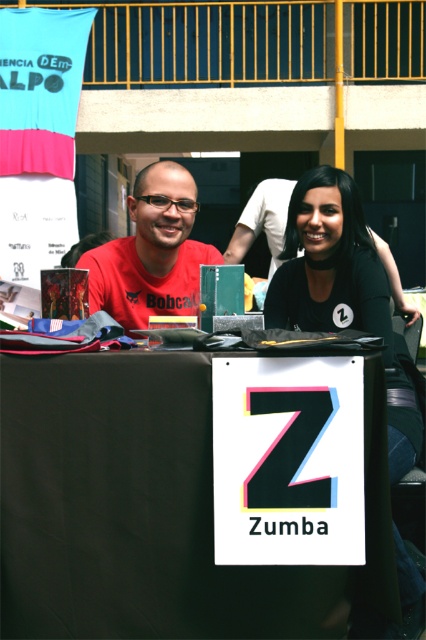
Question: Which point is farther to the camera?

Choices:
 (A) (163, 227)
 (B) (9, 477)

Answer: (A)

Question: Does black fabric table at center have a greater width compared to black matte shirt at center?

Choices:
 (A) yes
 (B) no

Answer: (A)

Question: In this image, where is black fabric table at center located relative to matte red t-shirt at center?

Choices:
 (A) below
 (B) above

Answer: (A)

Question: Considering the real-world distances, which object is closest to the black matte shirt at center?

Choices:
 (A) matte red t-shirt at center
 (B) black fabric table at center

Answer: (A)

Question: Can you confirm if black matte shirt at center is positioned to the right of matte red t-shirt at center?

Choices:
 (A) yes
 (B) no

Answer: (A)

Question: Among these objects, which one is farthest from the camera?

Choices:
 (A) matte red t-shirt at center
 (B) black matte shirt at center

Answer: (A)